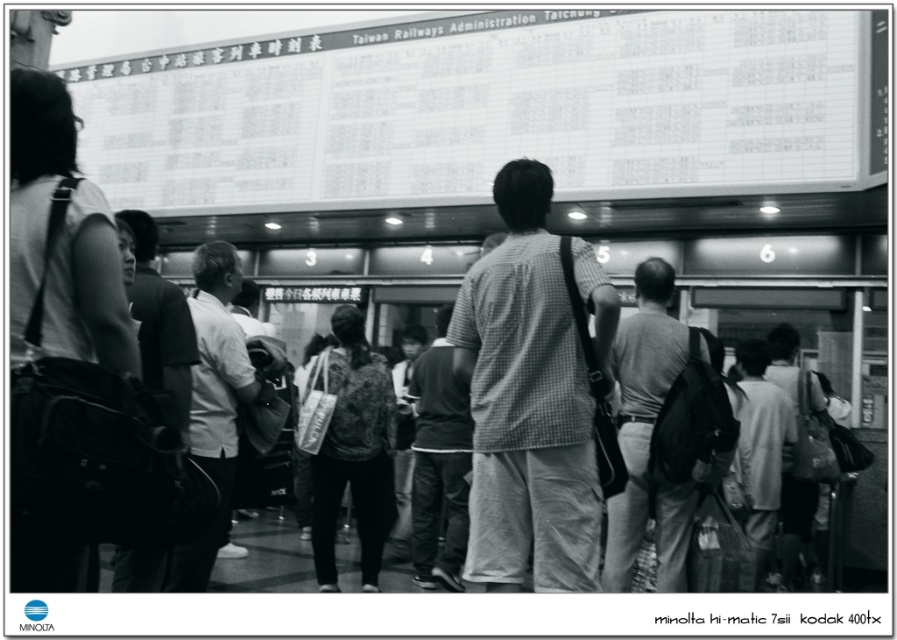
Does dark gray textured pants at center lie behind dark gray backpack at center?

Yes, it is.

Which is behind, point (434, 365) or point (179, 294)?

Point (434, 365)

At what (x,y) coordinates should I click in order to perform the action: click on dark gray textured pants at center. Please return your answer as a coordinate pair (x, y). The image size is (897, 640). Looking at the image, I should click on (438, 464).

From the picture: Can you confirm if white fabric shirt at center is wider than dark gray textured pants at center?

No.

Can you confirm if white fabric shirt at center is positioned above dark gray textured pants at center?

Yes, white fabric shirt at center is above dark gray textured pants at center.

Where is `white fabric shirt at center`? The width and height of the screenshot is (897, 640). white fabric shirt at center is located at coordinates pyautogui.click(x=215, y=400).

Which of these two, white fabric shirt at center or dark gray backpack at center, stands shorter?

With less height is dark gray backpack at center.

Which is in front, point (207, 557) or point (153, 220)?

Point (207, 557)

Is point (192, 300) positioned after point (141, 582)?

Yes, point (192, 300) is behind point (141, 582).

Find the location of a particular element. The height and width of the screenshot is (640, 897). white fabric shirt at center is located at coordinates (215, 400).